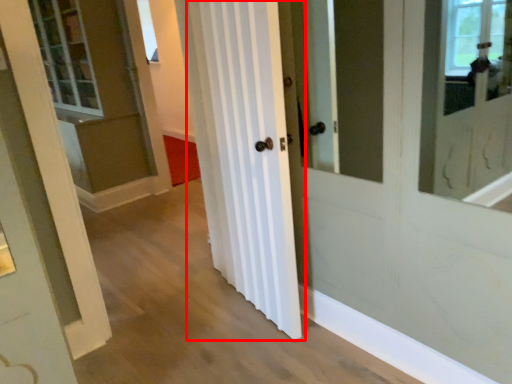
Question: From the image, what is the correct spatial relationship of curtain (annotated by the red box) in relation to window?

Choices:
 (A) left
 (B) right

Answer: (B)